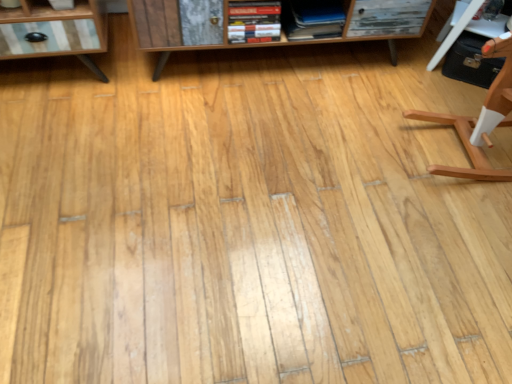
At what (x,y) coordinates should I click in order to perform the action: click on light brown wood rocking chair at right. Please return your answer as a coordinate pair (x, y). Image resolution: width=512 pixels, height=384 pixels. Looking at the image, I should click on (480, 118).

Image resolution: width=512 pixels, height=384 pixels. Describe the element at coordinates (480, 118) in the screenshot. I see `light brown wood rocking chair at right` at that location.

What is the approximate width of light brown wood rocking chair at right?

It is 22.08 inches.

The image size is (512, 384). Find the location of `light brown wood rocking chair at right`. light brown wood rocking chair at right is located at coordinates (480, 118).